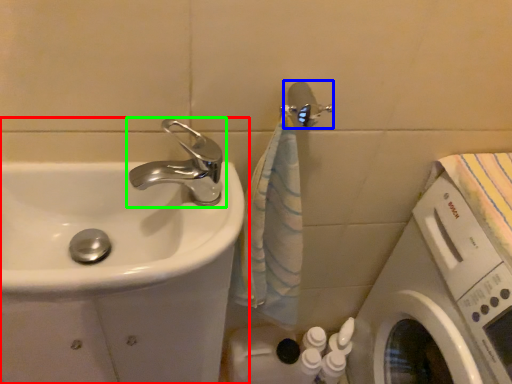
Question: Based on their relative distances, which object is nearer to sink (highlighted by a red box)? Choose from shower (highlighted by a blue box) and tap (highlighted by a green box).

Choices:
 (A) shower
 (B) tap

Answer: (B)